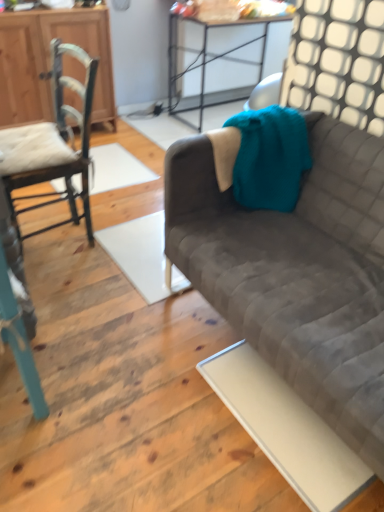
Question: From a real-world perspective, is metallic silver table at upper center located higher than velvet gray couch at right?

Choices:
 (A) no
 (B) yes

Answer: (B)

Question: From the image's perspective, would you say metallic silver table at upper center is shown under velvet gray couch at right?

Choices:
 (A) yes
 (B) no

Answer: (B)

Question: Considering the relative positions of metallic silver table at upper center and velvet gray couch at right in the image provided, is metallic silver table at upper center to the left of velvet gray couch at right from the viewer's perspective?

Choices:
 (A) no
 (B) yes

Answer: (B)

Question: Is the depth of metallic silver table at upper center greater than that of velvet gray couch at right?

Choices:
 (A) no
 (B) yes

Answer: (B)

Question: Is metallic silver table at upper center not inside velvet gray couch at right?

Choices:
 (A) no
 (B) yes

Answer: (B)

Question: From a real-world perspective, is metallic silver table at upper center located beneath velvet gray couch at right?

Choices:
 (A) no
 (B) yes

Answer: (A)

Question: Is teal wooden chair at left, the 1th chair viewed from the front, at the left side of velvet gray couch at right?

Choices:
 (A) yes
 (B) no

Answer: (A)

Question: Is the position of teal wooden chair at left, the 1th chair viewed from the front, more distant than that of velvet gray couch at right?

Choices:
 (A) no
 (B) yes

Answer: (A)

Question: Is teal wooden chair at left, the second chair positioned from the back, shorter than velvet gray couch at right?

Choices:
 (A) yes
 (B) no

Answer: (B)

Question: Is teal wooden chair at left, the 1th chair viewed from the front, positioned in front of velvet gray couch at right?

Choices:
 (A) no
 (B) yes

Answer: (B)

Question: Is teal wooden chair at left, the 1th chair viewed from the front, smaller than velvet gray couch at right?

Choices:
 (A) yes
 (B) no

Answer: (A)

Question: Can you confirm if teal wooden chair at left, the second chair positioned from the back, is positioned to the right of velvet gray couch at right?

Choices:
 (A) yes
 (B) no

Answer: (B)

Question: From a real-world perspective, is wooden cabinet at left over teal wooden chair at left, the 1th chair viewed from the front?

Choices:
 (A) yes
 (B) no

Answer: (B)